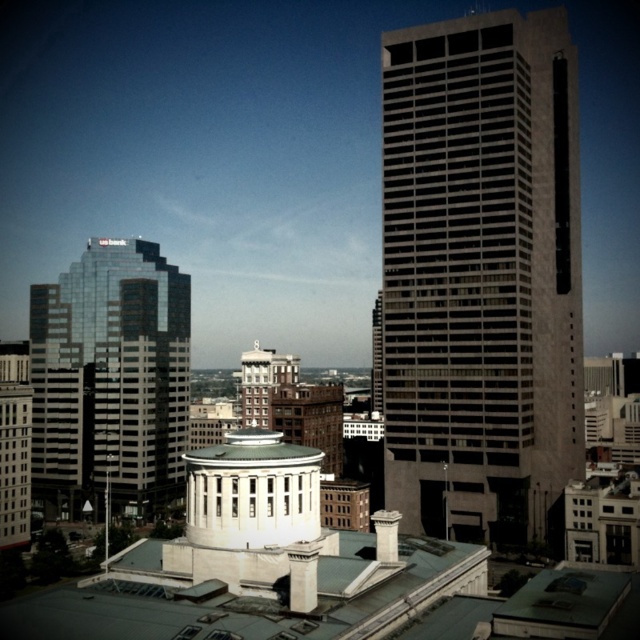
Question: Which object is farther from the camera taking this photo?

Choices:
 (A) gray concrete skyscraper at center
 (B) reflective glass skyscraper at left

Answer: (B)

Question: Among these points, which one is nearest to the camera?

Choices:
 (A) (81, 426)
 (B) (429, 278)

Answer: (B)

Question: Does gray concrete skyscraper at center have a larger size compared to reflective glass skyscraper at left?

Choices:
 (A) no
 (B) yes

Answer: (B)

Question: Which point appears farthest from the camera in this image?

Choices:
 (A) (179, 342)
 (B) (582, 426)

Answer: (A)

Question: Does gray concrete skyscraper at center appear over reflective glass skyscraper at left?

Choices:
 (A) no
 (B) yes

Answer: (B)

Question: Does gray concrete skyscraper at center appear over reflective glass skyscraper at left?

Choices:
 (A) yes
 (B) no

Answer: (A)